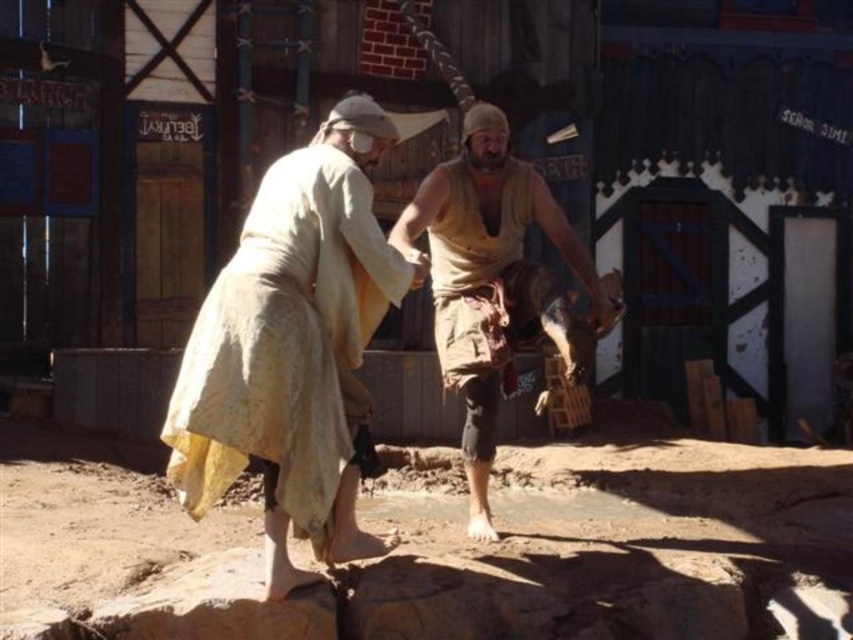
Does light beige fabric dress at center appear on the right side of brown rough fabric shirt at center?

No, light beige fabric dress at center is not to the right of brown rough fabric shirt at center.

Which of these two, light beige fabric dress at center or brown rough fabric shirt at center, stands taller?

Standing taller between the two is brown rough fabric shirt at center.

Which is behind, point (318, 440) or point (569, 364)?

Positioned behind is point (569, 364).

The width and height of the screenshot is (853, 640). What are the coordinates of `light beige fabric dress at center` in the screenshot? It's located at (293, 348).